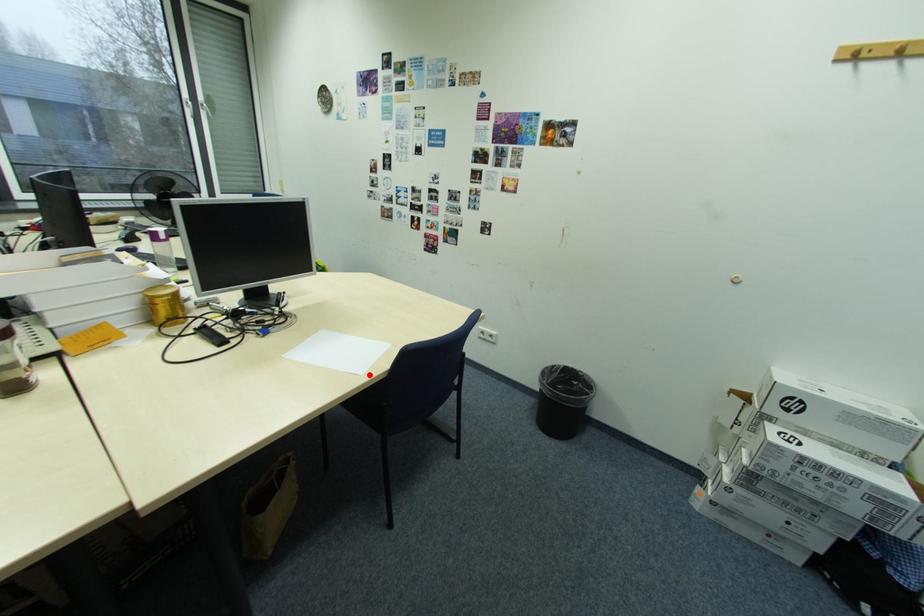
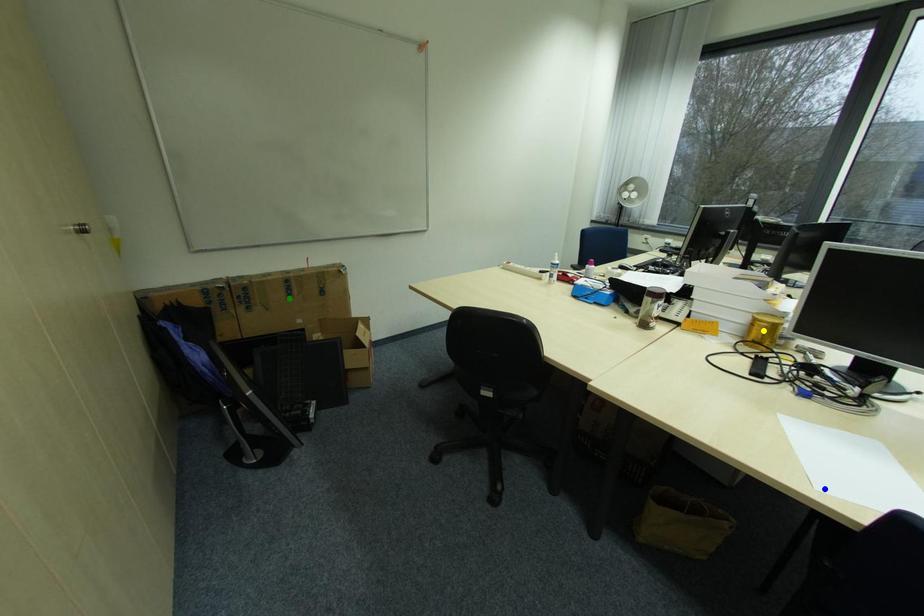
Question: I am providing you with two images of the same scene from different viewpoints. A red point is marked on the first image. You are given multiple points on the second image. Which point in image 2 is actually the same real-world point as the red point in image 1?

Choices:
 (A) green point
 (B) yellow point
 (C) blue point

Answer: (C)